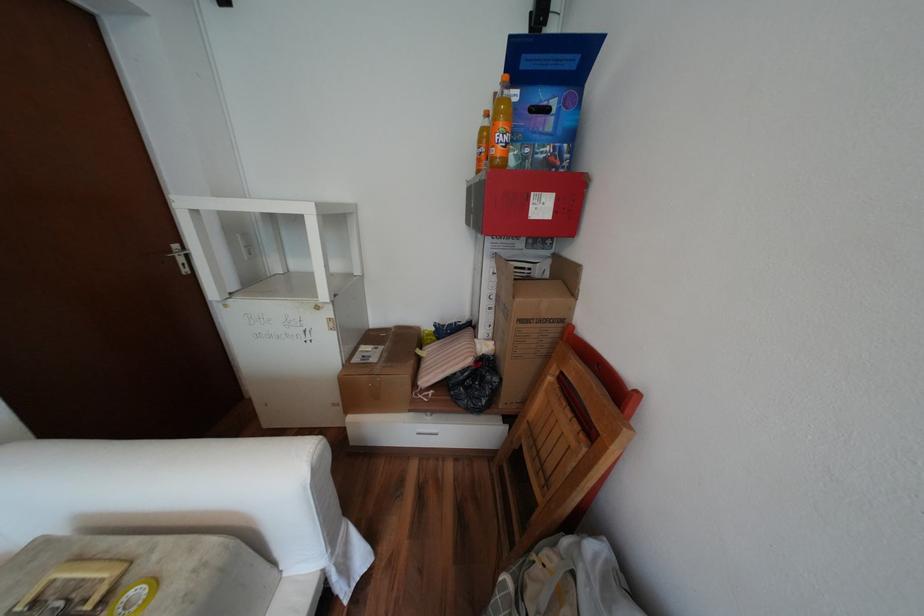
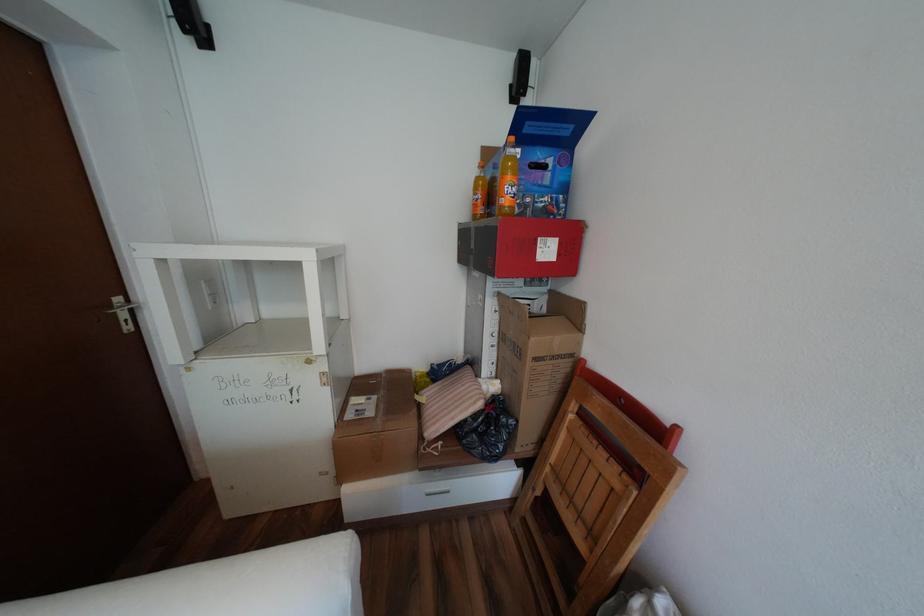
Question: The camera is either moving clockwise (left) or counter-clockwise (right) around the object. The first image is from the beginning of the video and the second image is from the end. Is the camera moving left or right when shooting the video?

Choices:
 (A) Left
 (B) Right

Answer: (A)